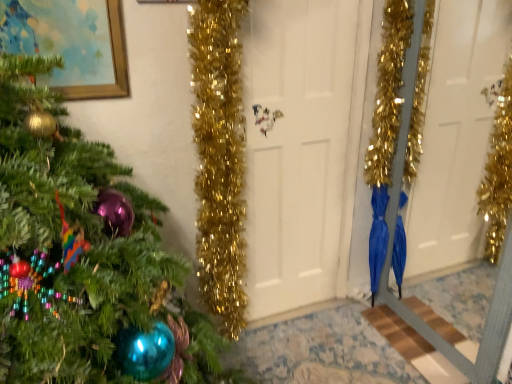
Question: From a real-world perspective, is gold-framed painting at upper left on top of blue glossy umbrella at lower right?

Choices:
 (A) no
 (B) yes

Answer: (B)

Question: Is gold-framed painting at upper left at the right side of blue glossy umbrella at lower right?

Choices:
 (A) yes
 (B) no

Answer: (B)

Question: Would you say blue glossy umbrella at lower right is part of gold-framed painting at upper left's contents?

Choices:
 (A) yes
 (B) no

Answer: (B)

Question: Is gold-framed painting at upper left in front of blue glossy umbrella at lower right?

Choices:
 (A) yes
 (B) no

Answer: (A)

Question: Considering the relative sizes of gold-framed painting at upper left and blue glossy umbrella at lower right in the image provided, is gold-framed painting at upper left smaller than blue glossy umbrella at lower right?

Choices:
 (A) no
 (B) yes

Answer: (B)

Question: From the image's perspective, would you say gold-framed painting at upper left is positioned over blue glossy umbrella at lower right?

Choices:
 (A) yes
 (B) no

Answer: (A)

Question: Can you confirm if blue glossy umbrella at lower right is positioned to the right of white matte door at center?

Choices:
 (A) yes
 (B) no

Answer: (A)

Question: Is blue glossy umbrella at lower right at the left side of white matte door at center?

Choices:
 (A) yes
 (B) no

Answer: (B)

Question: From the image's perspective, is blue glossy umbrella at lower right beneath white matte door at center?

Choices:
 (A) no
 (B) yes

Answer: (B)

Question: Can you confirm if blue glossy umbrella at lower right is taller than white matte door at center?

Choices:
 (A) yes
 (B) no

Answer: (B)

Question: From the image's perspective, is blue glossy umbrella at lower right above white matte door at center?

Choices:
 (A) yes
 (B) no

Answer: (B)

Question: Is blue glossy umbrella at lower right further to the viewer compared to white matte door at center?

Choices:
 (A) no
 (B) yes

Answer: (B)

Question: Does white matte door at center have a lesser height compared to gold-framed painting at upper left?

Choices:
 (A) yes
 (B) no

Answer: (B)